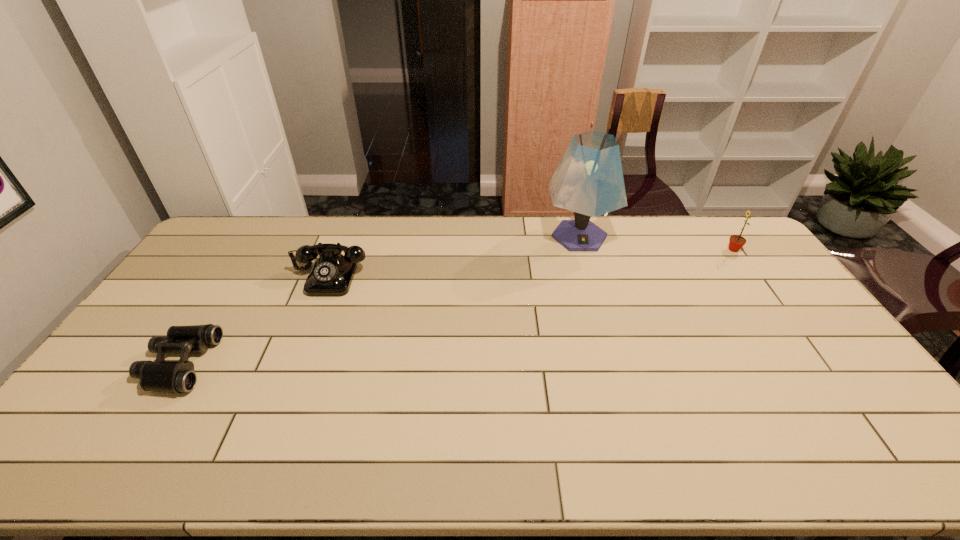
Locate an element on the screen. This screenshot has width=960, height=540. free space located 0.200m on the face of the rightmost object is located at coordinates (671, 249).

Where is `free space located on the face of the rightmost object`? free space located on the face of the rightmost object is located at coordinates (701, 249).

At what (x,y) coordinates should I click in order to perform the action: click on vacant space situated 0.160m on the dial of the third tallest object. Please return your answer as a coordinate pair (x, y). This screenshot has width=960, height=540. Looking at the image, I should click on (307, 334).

This screenshot has height=540, width=960. I want to click on vacant space located on the front-facing side of the leftmost object, so pos(281,363).

At what (x,y) coordinates should I click in order to perform the action: click on lampshade situated at the far edge. Please return your answer as a coordinate pair (x, y). Looking at the image, I should click on (589, 181).

What are the coordinates of `sunflower at the far edge` in the screenshot? It's located at (736, 242).

Where is `object at the left edge`? object at the left edge is located at coordinates (177, 377).

At what (x,y) coordinates should I click in order to perform the action: click on object that is at the right edge. Please return your answer as a coordinate pair (x, y). The width and height of the screenshot is (960, 540). Looking at the image, I should click on (736, 242).

The width and height of the screenshot is (960, 540). In order to click on object located in the far right corner section of the desktop in this screenshot , I will do `click(736, 242)`.

Identify the location of vacant space at the far edge of the desktop. (362, 241).